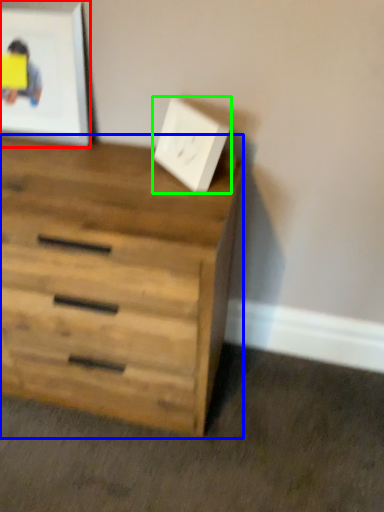
Question: Which object is the farthest from picture frame (highlighted by a red box)? Choose among these: chest of drawers (highlighted by a blue box) or electric outlet (highlighted by a green box).

Choices:
 (A) chest of drawers
 (B) electric outlet

Answer: (A)